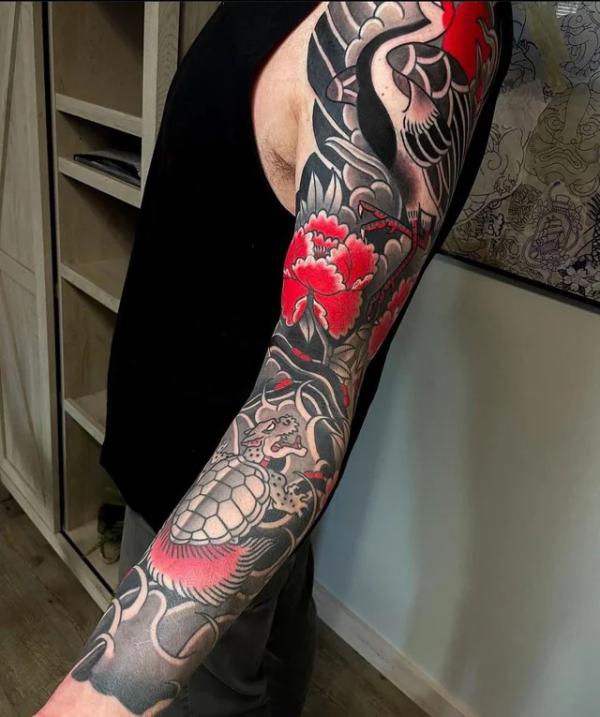
This screenshot has width=600, height=717. I want to click on white wall, so click(x=521, y=482).